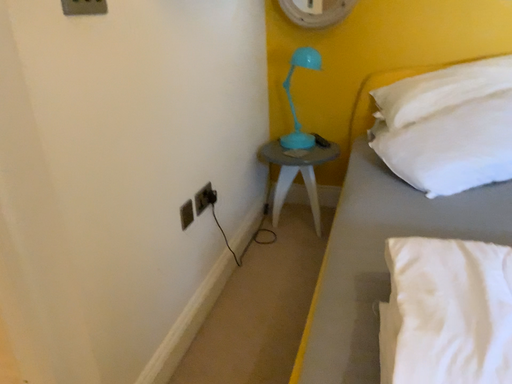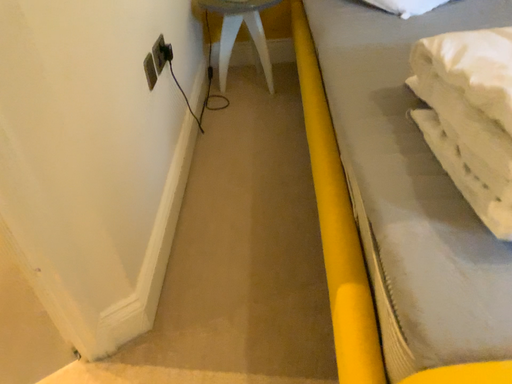
Question: How did the camera likely rotate when shooting the video?

Choices:
 (A) rotated left
 (B) rotated right

Answer: (B)